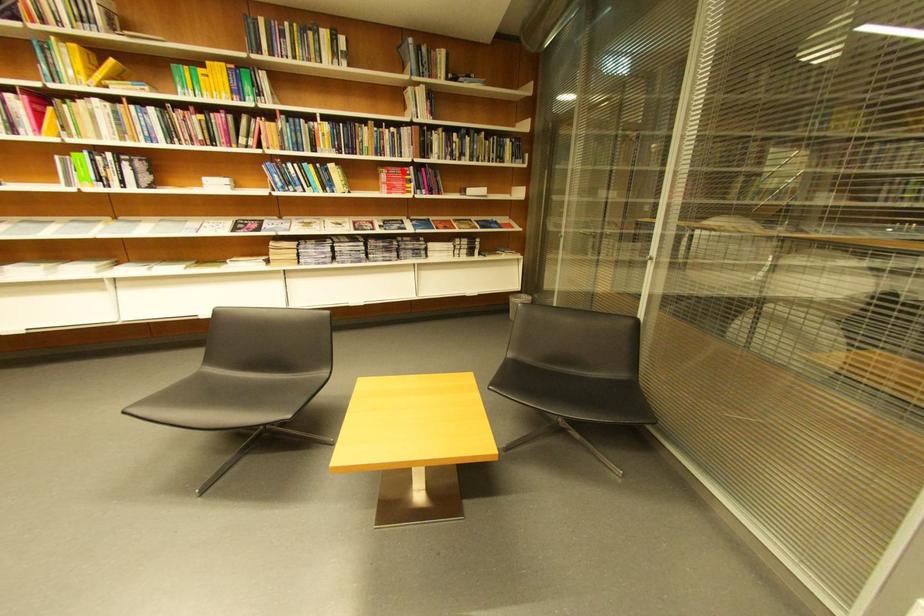
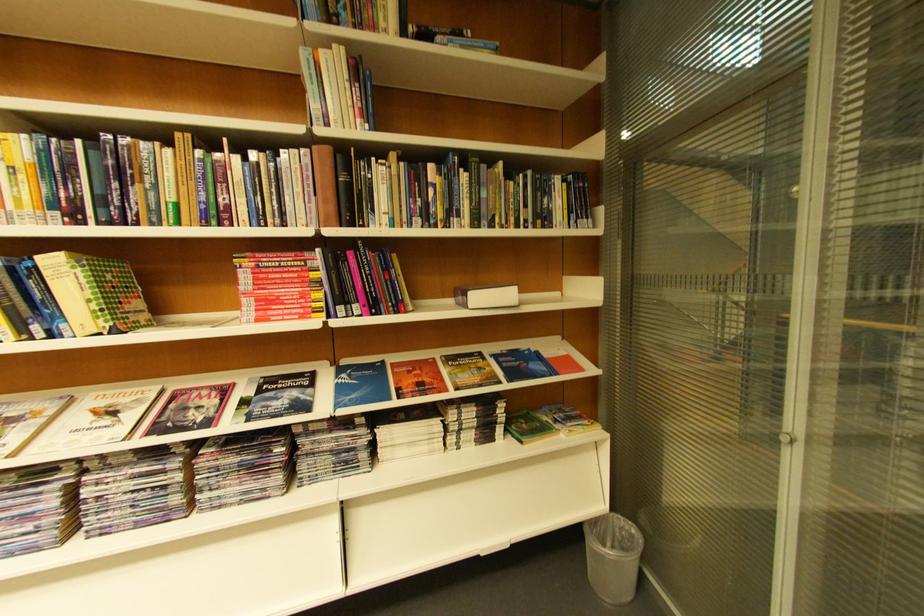
Question: I am providing you with two images of the same scene from different viewpoints. Given a red point in image1, look at the same physical point in image2. Is it:

Choices:
 (A) Closer to the viewpoint
 (B) Farther from the viewpoint

Answer: (B)